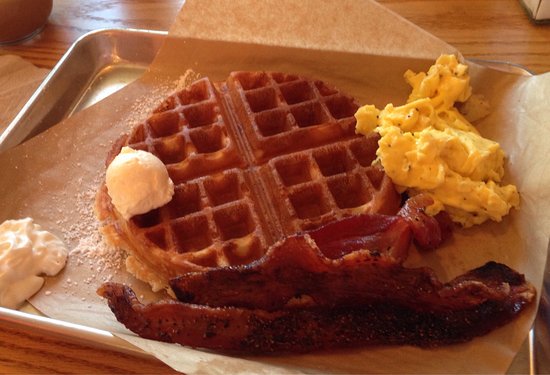
Find the location of `tray`. tray is located at coordinates (120, 54).